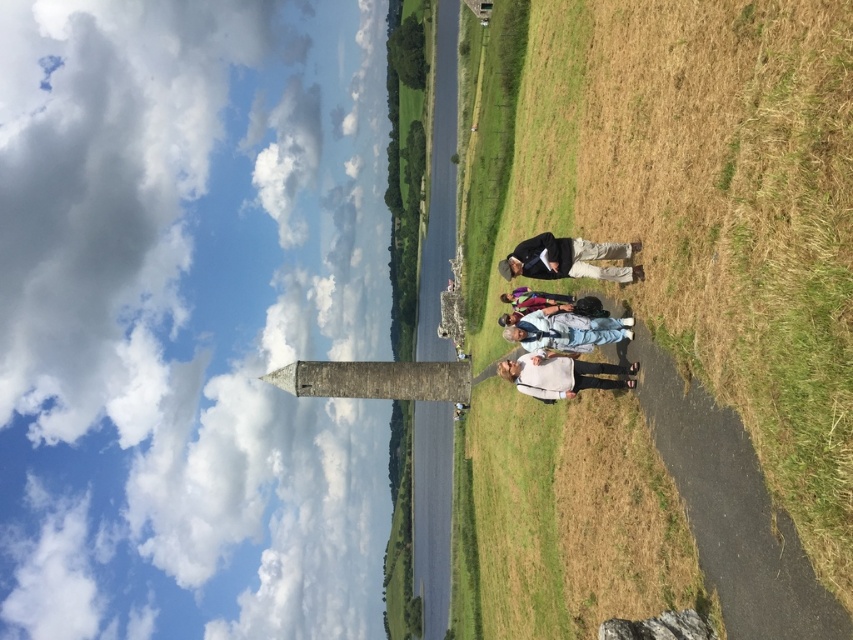
Is point (540, 129) in front of point (601, 339)?

No, (540, 129) is further to viewer.

Can you confirm if dry grass at center is positioned to the right of light blue denim jeans at center?

Indeed, dry grass at center is positioned on the right side of light blue denim jeans at center.

Is point (838, 113) more distant than point (593, 340)?

That is False.

I want to click on dry grass at center, so click(x=715, y=209).

Is dark gray jacket at center above light blue denim jeans at center?

Indeed, dark gray jacket at center is positioned over light blue denim jeans at center.

Does dark gray jacket at center have a larger size compared to light blue denim jeans at center?

Indeed, dark gray jacket at center has a larger size compared to light blue denim jeans at center.

Is point (535, 275) positioned behind point (614, 328)?

Yes, point (535, 275) is farther from viewer.

Identify the location of dark gray jacket at center. (567, 259).

Is point (543, 246) closer to camera compared to point (508, 301)?

Yes.

Which is behind, point (581, 273) or point (558, 305)?

Positioned behind is point (558, 305).

Between point (582, 273) and point (567, 294), which one is positioned in front?

Point (582, 273) is in front.

Identify the location of dark gray jacket at center. (567, 259).